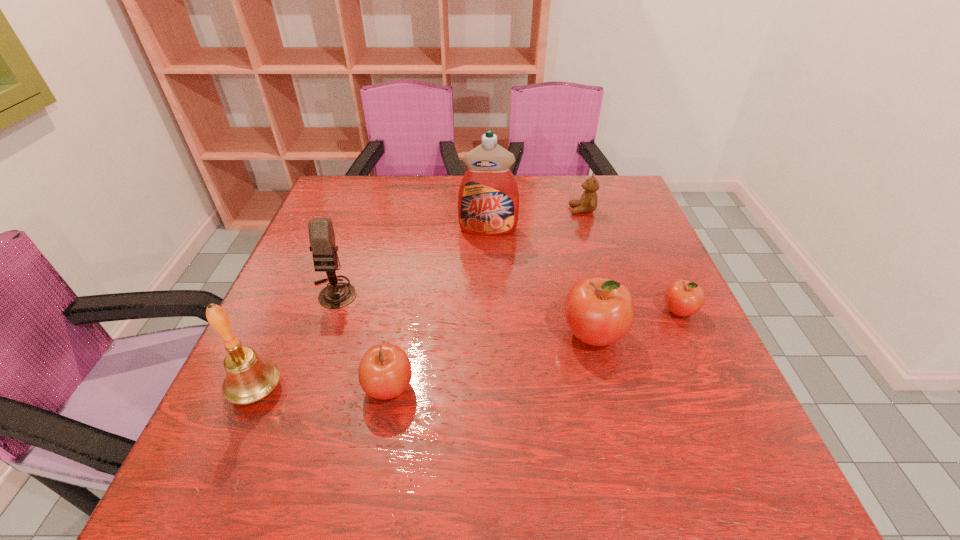
Where is `vacant space that satisfies the following two spatial constraints: 1. on the back side of the shortest apple; 2. on the right side of the second shortest apple`? The height and width of the screenshot is (540, 960). vacant space that satisfies the following two spatial constraints: 1. on the back side of the shortest apple; 2. on the right side of the second shortest apple is located at coordinates (402, 310).

The height and width of the screenshot is (540, 960). Identify the location of free space that satisfies the following two spatial constraints: 1. on the front-facing side of the farthest object; 2. on the front surface of the sixth nearest object. (588, 230).

Image resolution: width=960 pixels, height=540 pixels. I want to click on vacant position in the image that satisfies the following two spatial constraints: 1. on the front surface of the rightmost apple; 2. on the left side of the second farthest object, so 490,310.

You are a GUI agent. You are given a task and a screenshot of the screen. Output one action in this format:
    pyautogui.click(x=<x>, y=<y>)
    Task: Click on the free space that satisfies the following two spatial constraints: 1. on the back side of the shortest apple; 2. on the left side of the second apple from left to right
    The width and height of the screenshot is (960, 540).
    Given the screenshot: What is the action you would take?
    pyautogui.click(x=587, y=310)

Where is `free space that satisfies the following two spatial constraints: 1. on the front-facing side of the teddy bear; 2. on the front side of the tallest apple`? Image resolution: width=960 pixels, height=540 pixels. free space that satisfies the following two spatial constraints: 1. on the front-facing side of the teddy bear; 2. on the front side of the tallest apple is located at coordinates (620, 334).